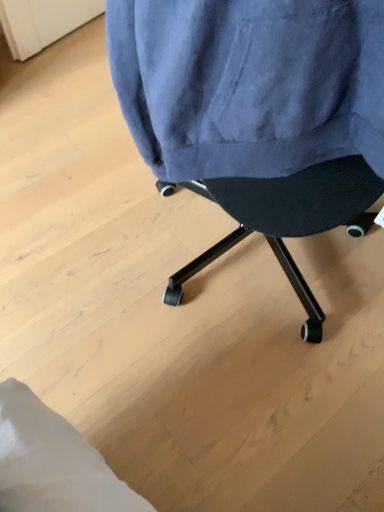
Identify the location of vacant area in front of suede-like blue chair at center. point(228,399).